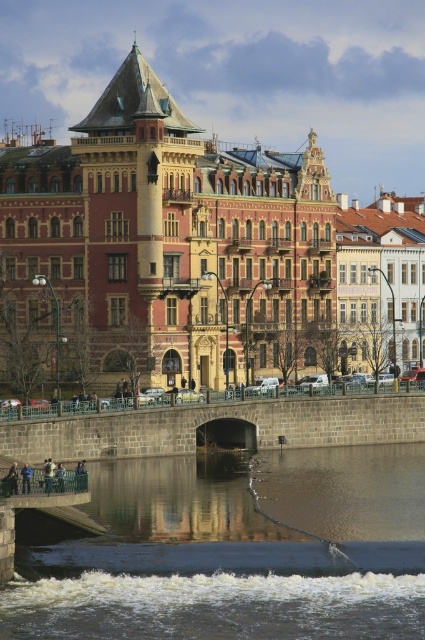
Question: Among these objects, which one is farthest from the camera?

Choices:
 (A) smooth concrete river at center
 (B) green metal bridge at lower left

Answer: (B)

Question: Which of the following is the closest to the observer?

Choices:
 (A) (56, 524)
 (B) (130, 529)

Answer: (A)

Question: Is smooth concrete river at center positioned behind green metal bridge at lower left?

Choices:
 (A) yes
 (B) no

Answer: (B)

Question: Can you confirm if smooth concrete river at center is positioned above green metal bridge at lower left?

Choices:
 (A) yes
 (B) no

Answer: (B)

Question: Does smooth concrete river at center have a greater width compared to green metal bridge at lower left?

Choices:
 (A) yes
 (B) no

Answer: (A)